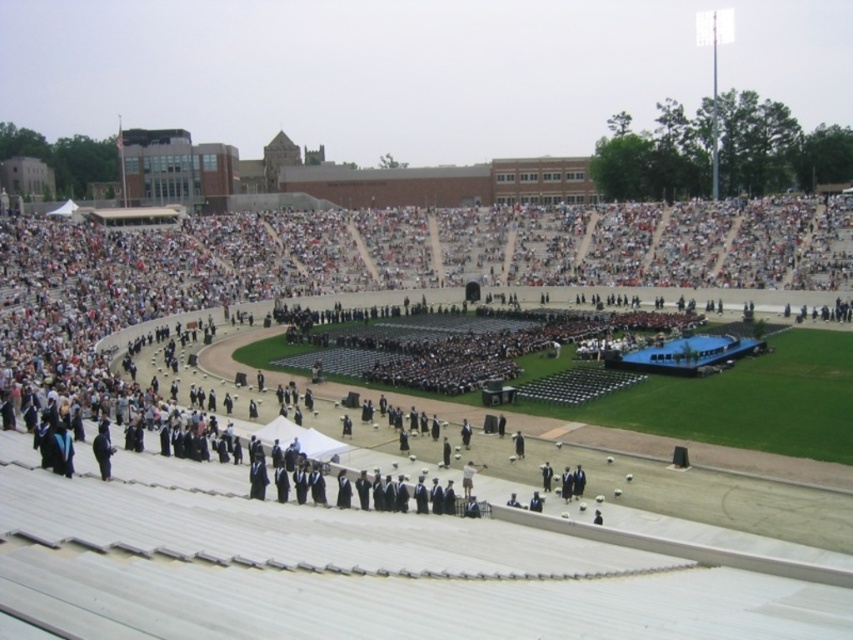
Question: Does black graduation gown at center appear on the right side of black matte suit at lower left?

Choices:
 (A) no
 (B) yes

Answer: (B)

Question: Which point is farther to the camera?

Choices:
 (A) (94, 442)
 (B) (759, 401)

Answer: (B)

Question: Does black graduation gown at center have a lesser width compared to black matte suit at lower left?

Choices:
 (A) no
 (B) yes

Answer: (A)

Question: Which point is closer to the camera?

Choices:
 (A) (103, 440)
 (B) (320, 253)

Answer: (A)

Question: Does black graduation gown at center appear on the right side of black matte suit at lower left?

Choices:
 (A) no
 (B) yes

Answer: (B)

Question: Which of the following is the farthest from the observer?

Choices:
 (A) black graduation gown at center
 (B) black matte suit at lower left

Answer: (A)